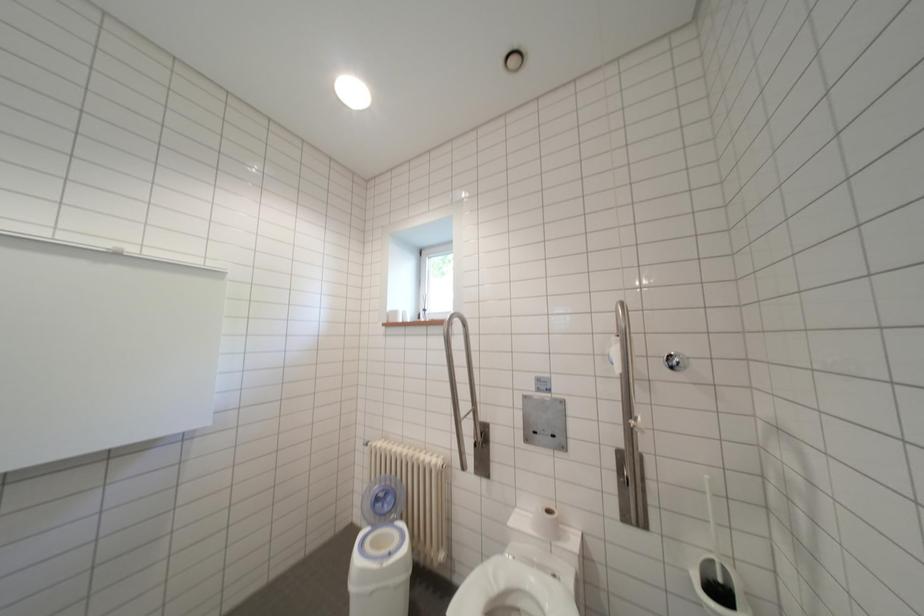
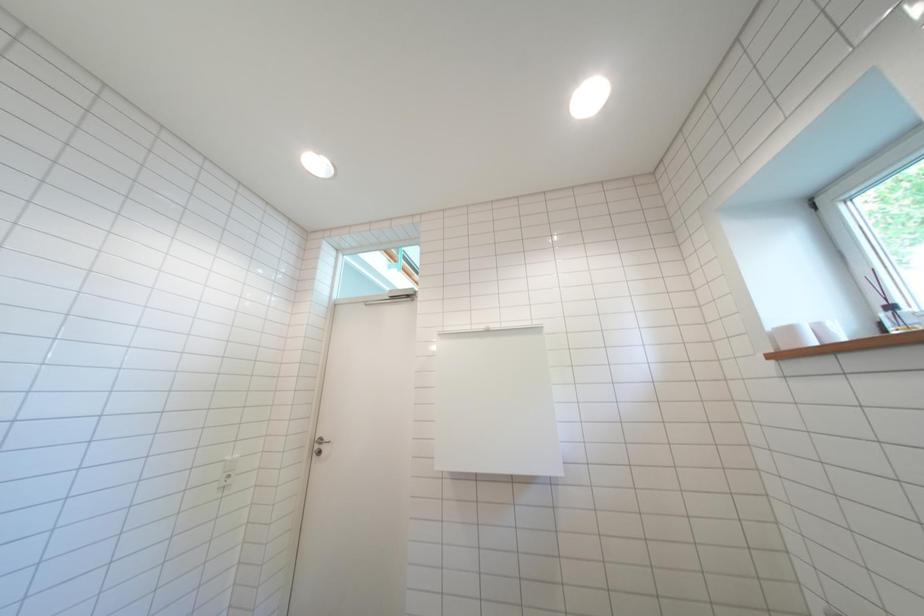
Based on the continuous images, in which direction is the camera rotating?

The rotation direction of the camera is left-up.